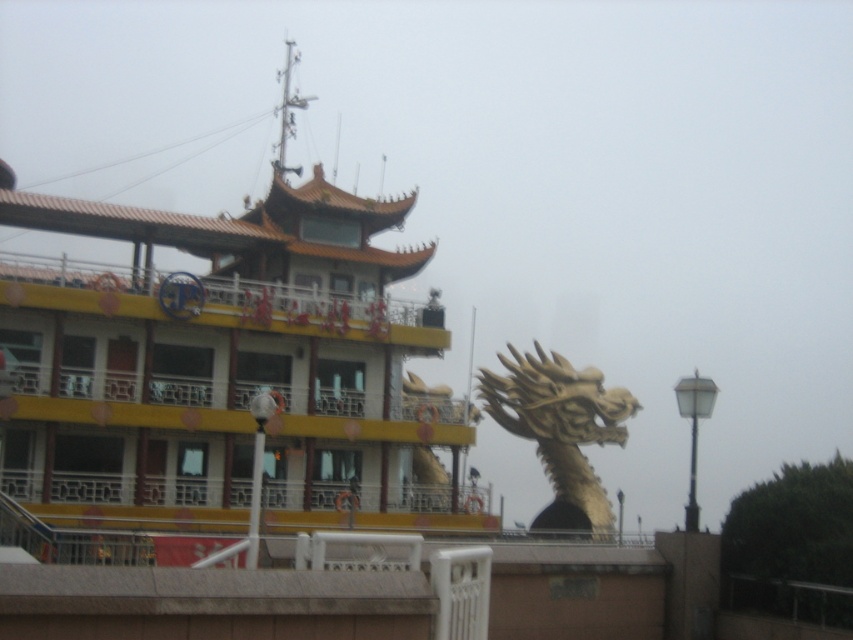
Who is taller, yellow matte boat at upper left or white glass lamp post at right?

yellow matte boat at upper left

Which is in front, point (326, 262) or point (675, 394)?

Point (326, 262) is in front.

Which is behind, point (74, 205) or point (704, 396)?

Point (74, 205)

Where is `yellow matte boat at upper left`? The image size is (853, 640). yellow matte boat at upper left is located at coordinates (225, 365).

Where is `yellow matte boat at upper left`? yellow matte boat at upper left is located at coordinates (225, 365).

Can you confirm if yellow matte boat at upper left is positioned to the right of gold metallic dragon at center?

No, yellow matte boat at upper left is not to the right of gold metallic dragon at center.

Who is more forward, (432, 332) or (556, 513)?

Point (432, 332) is in front.

Identify the location of yellow matte boat at upper left. (225, 365).

Who is lower down, gold metallic dragon at center or white glass lamp post at right?

gold metallic dragon at center is below.

Is gold metallic dragon at center taller than white glass lamp post at right?

Correct, gold metallic dragon at center is much taller as white glass lamp post at right.

Measure the distance between gold metallic dragon at center and camera.

A distance of 364.40 feet exists between gold metallic dragon at center and camera.

Where is `gold metallic dragon at center`? gold metallic dragon at center is located at coordinates (560, 432).